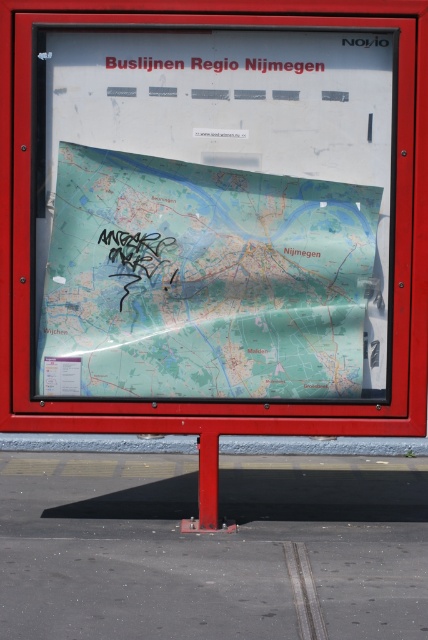
Does transparent plastic map at center come in front of black paper at upper center?

No.

Who is more forward, (95, 312) or (270, 68)?

Point (270, 68)

The image size is (428, 640). In order to click on transparent plastic map at center in this screenshot , I will do `click(204, 282)`.